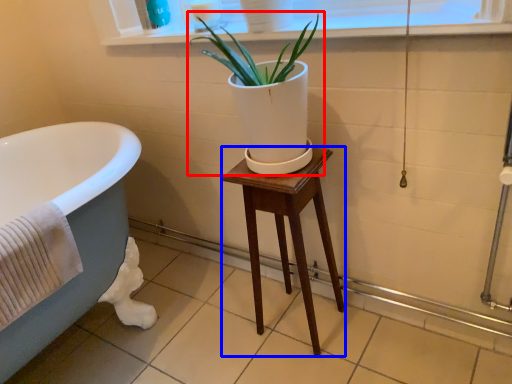
Question: Which point is closer to the camera, houseplant (highlighted by a red box) or stool (highlighted by a blue box)?

Choices:
 (A) houseplant
 (B) stool

Answer: (A)